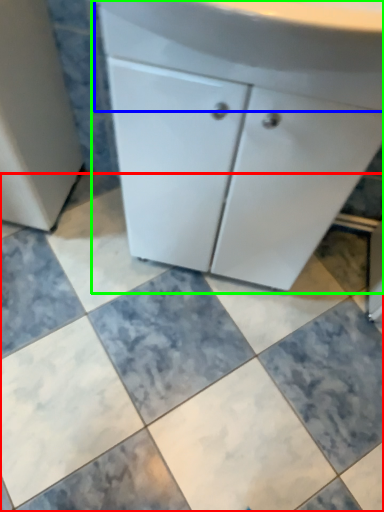
Question: Which object is the closest to the ceramic tile (highlighted by a red box)? Choose among these: counter top (highlighted by a blue box) or bathroom cabinet (highlighted by a green box).

Choices:
 (A) counter top
 (B) bathroom cabinet

Answer: (B)